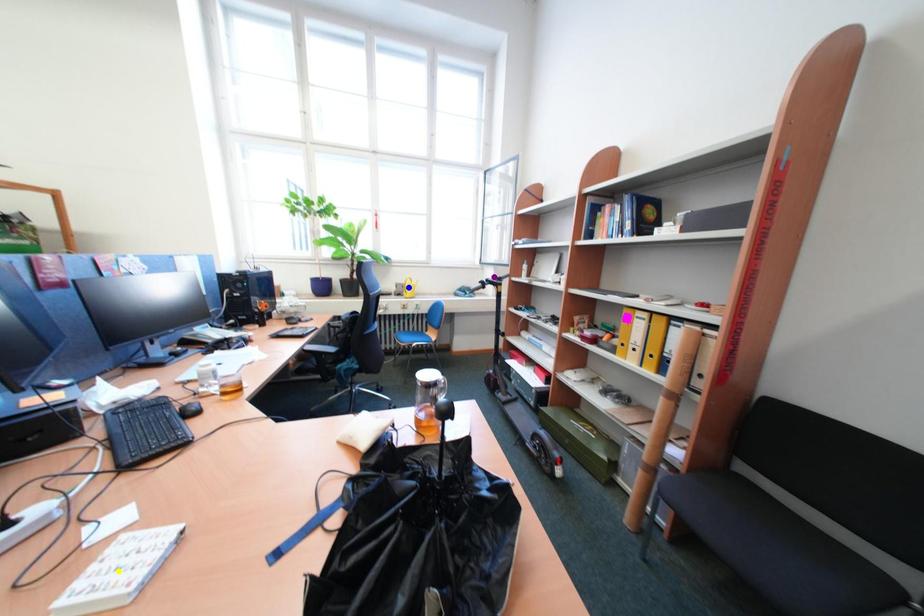
Order these from nearest to farthest:
A) blue point
B) yellow point
C) purple point

yellow point
purple point
blue point